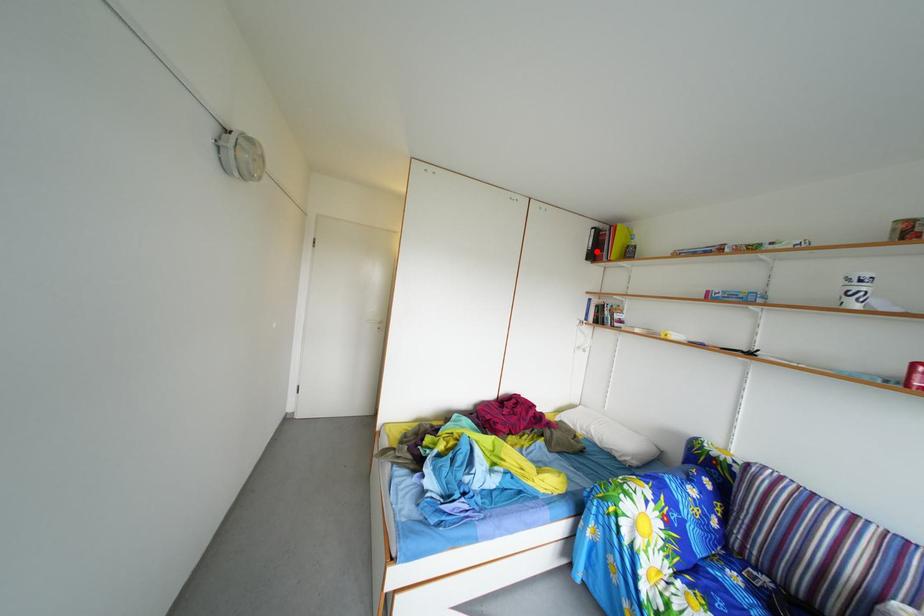
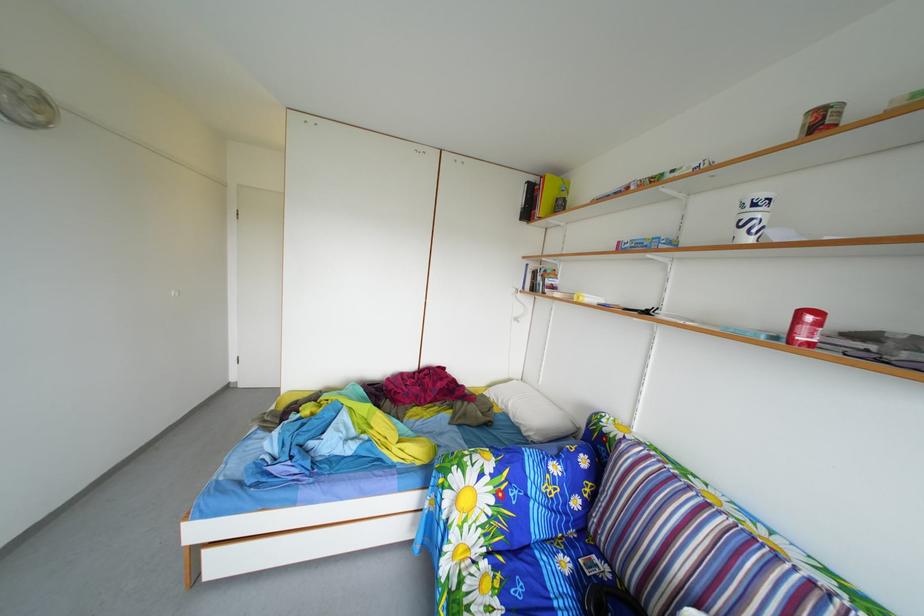
Find the pixel in the second image that matches the highlighted location in the first image.

(530, 208)